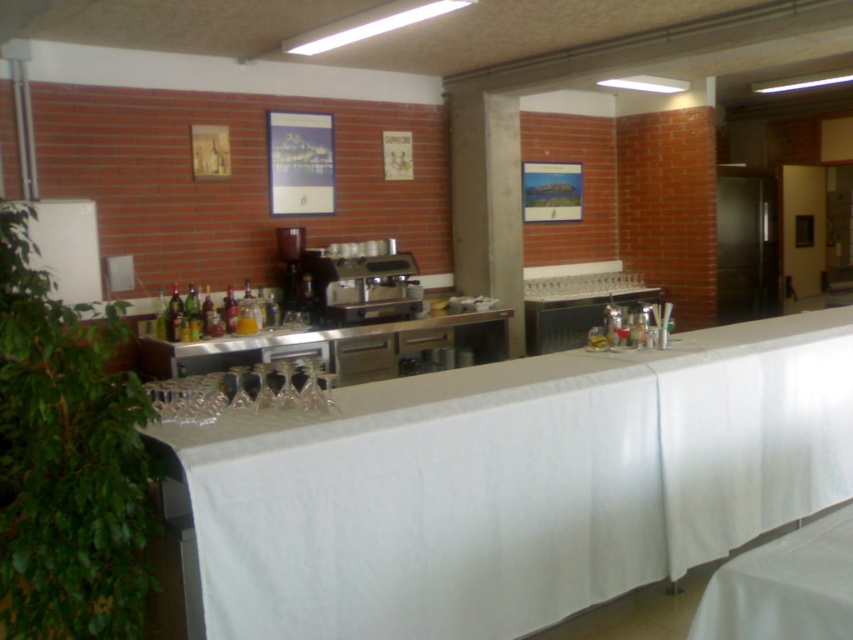
You are a barista working at the bar and need to place a large tray on the counter. The tray is as wide as the satin silver coffee machine at center. Can the stainless steel counter at center accommodate the tray?

The stainless steel counter at center is wider than the satin silver coffee machine at center, so the tray, which is as wide as the coffee machine, can fit on the counter.

You are a customer at the bar and want to place your drink on the white fabric table at center. However, you notice the satin silver coffee machine at center is in the way. Which direction should you move the coffee machine to access the table?

The white fabric table at center is to the right of the satin silver coffee machine at center. To access the table, you should move the satin silver coffee machine at center to the left.

You are a barista working at the bar. You need to place a large tray of freshly baked cookies on the counter. Which object from the stainless steel counter at center and the satin silver coffee machine at center should you choose to place the tray on?

The stainless steel counter at center is larger in size than the satin silver coffee machine at center, so you should place the tray on the stainless steel counter at center as it has more space.